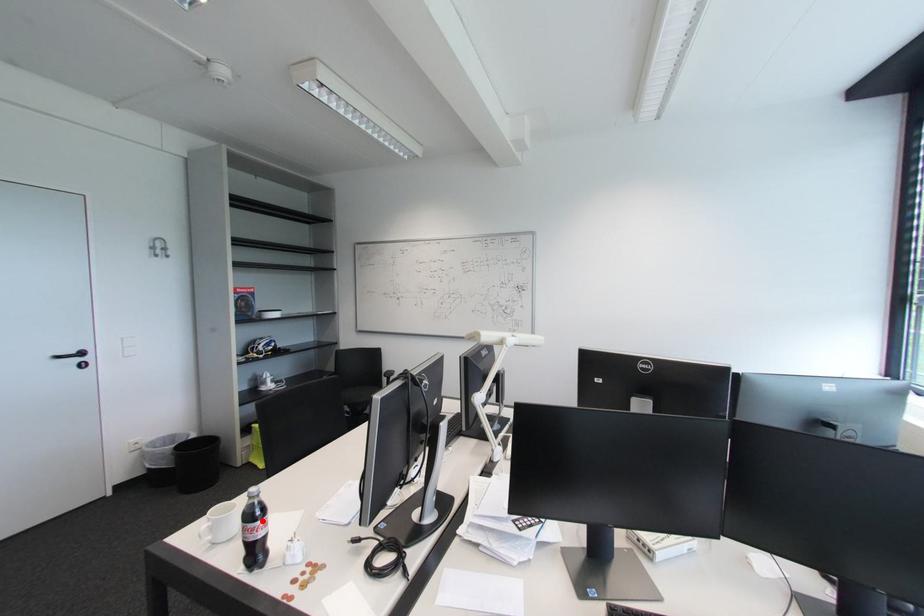
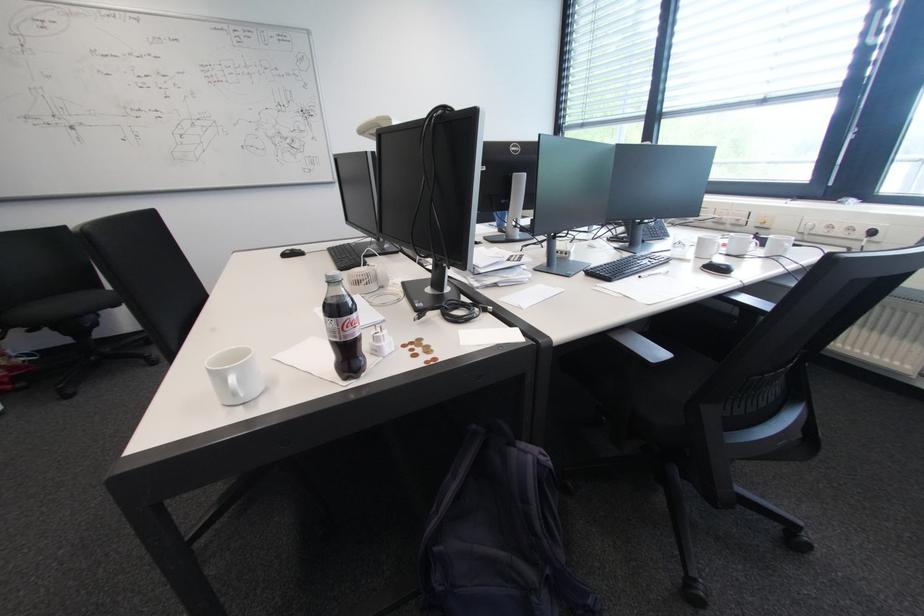
The point at the highlighted location is marked in the first image. Where is the corresponding point in the second image?

(355, 313)